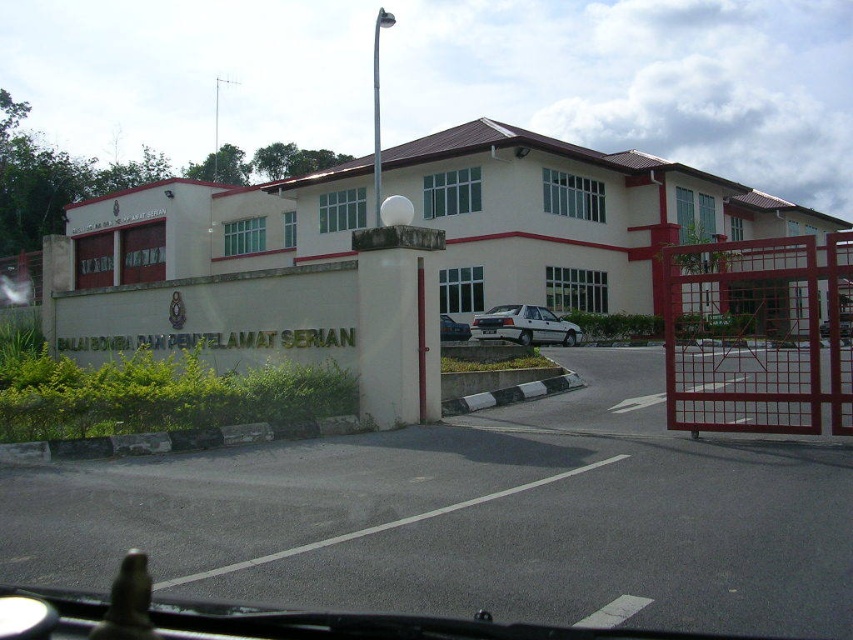
Does asphalt pavement at center appear on the right side of silver metallic sedan at center?

Correct, you'll find asphalt pavement at center to the right of silver metallic sedan at center.

From the picture: Can you confirm if asphalt pavement at center is positioned below silver metallic sedan at center?

Correct, asphalt pavement at center is located below silver metallic sedan at center.

Find the location of `asphalt pavement at center`. asphalt pavement at center is located at coordinates (474, 516).

Which is more to the left, asphalt pavement at center or white matte sedan at center?

Positioned to the left is asphalt pavement at center.

Can you confirm if asphalt pavement at center is smaller than white matte sedan at center?

Yes, asphalt pavement at center is smaller than white matte sedan at center.

This screenshot has height=640, width=853. What do you see at coordinates (474, 516) in the screenshot? I see `asphalt pavement at center` at bounding box center [474, 516].

Identify the location of asphalt pavement at center. (474, 516).

Which is more to the left, white matte sedan at center or silver metallic sedan at center?

silver metallic sedan at center

Can you confirm if white matte sedan at center is smaller than silver metallic sedan at center?

Yes, white matte sedan at center is smaller than silver metallic sedan at center.

Is point (508, 333) positioned after point (457, 336)?

That is False.

This screenshot has height=640, width=853. What are the coordinates of `white matte sedan at center` in the screenshot? It's located at (524, 324).